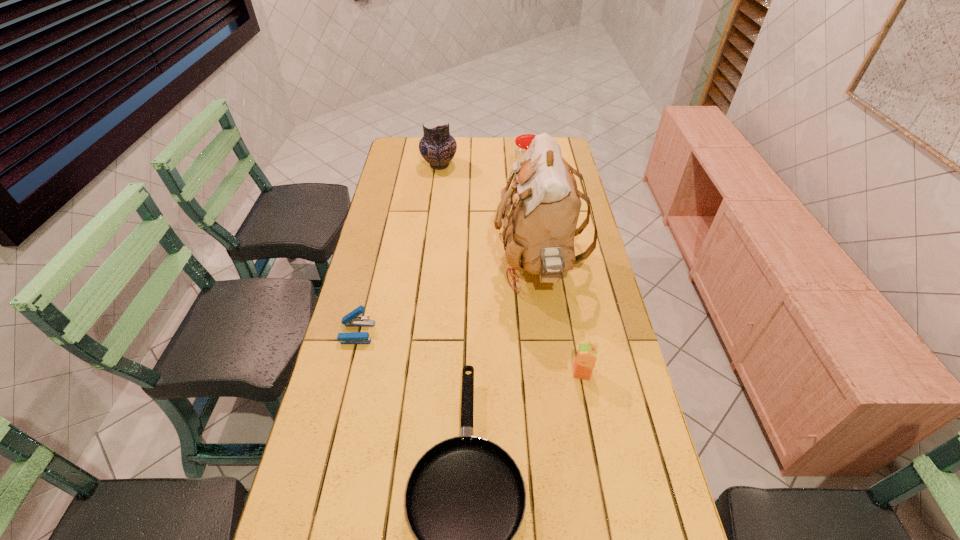
Locate which object is the third closest to the fifth tallest object. Please provide its 2D coordinates. Your answer should be formatted as a tuple, i.e. [(x, y)], where the tuple contains the x and y coordinates of a point satisfying the conditions above.

[(586, 357)]

Locate which object is the fourth closest to the leftmost object. Please provide its 2D coordinates. Your answer should be formatted as a tuple, i.e. [(x, y)], where the tuple contains the x and y coordinates of a point satisfying the conditions above.

[(437, 146)]

The width and height of the screenshot is (960, 540). Identify the location of free spot that satisfies the following two spatial constraints: 1. on the back side of the orange juice; 2. on the front-facing side of the fourth nearest object. (562, 266).

At what (x,y) coordinates should I click in order to perform the action: click on free space that satisfies the following two spatial constraints: 1. on the front side of the fourth tallest object; 2. on the right side of the leftmost object. Please return your answer as a coordinate pair (x, y). The image size is (960, 540). Looking at the image, I should click on (348, 373).